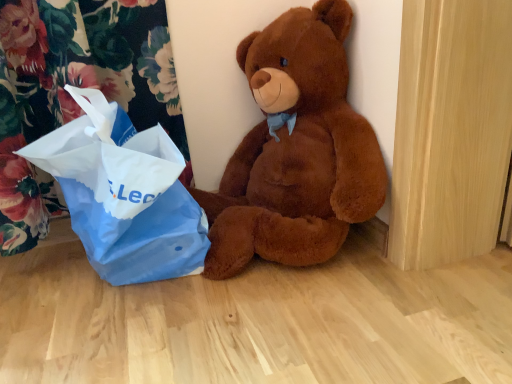
Describe the element at coordinates (76, 86) in the screenshot. I see `blue paper bag at left` at that location.

You are a GUI agent. You are given a task and a screenshot of the screen. Output one action in this format:
    pyautogui.click(x=<x>, y=<y>)
    Task: Click on the blue paper bag at left
    Image resolution: width=512 pixels, height=384 pixels.
    Given the screenshot: What is the action you would take?
    pyautogui.click(x=76, y=86)

You are a GUI agent. You are given a task and a screenshot of the screen. Output one action in this format:
    pyautogui.click(x=<x>, y=<y>)
    Task: Click on the brown plush teddy bear at center
    Image resolution: width=512 pixels, height=384 pixels.
    Given the screenshot: What is the action you would take?
    pyautogui.click(x=295, y=150)

This screenshot has width=512, height=384. What do you see at coordinates (295, 150) in the screenshot?
I see `brown plush teddy bear at center` at bounding box center [295, 150].

At what (x,y) coordinates should I click in order to perform the action: click on blue paper bag at left. Please return your answer as a coordinate pair (x, y). Looking at the image, I should click on (76, 86).

Considering the positions of objects brown plush teddy bear at center and blue paper bag at left in the image provided, who is more to the left, brown plush teddy bear at center or blue paper bag at left?

blue paper bag at left.

Which object is closer to the camera, brown plush teddy bear at center or blue paper bag at left?

brown plush teddy bear at center is closer to the camera.

Which is further, (284, 114) or (2, 154)?

Positioned behind is point (284, 114).

From the image's perspective, does brown plush teddy bear at center appear higher than blue paper bag at left?

Yes, from the image's perspective, brown plush teddy bear at center is over blue paper bag at left.

From a real-world perspective, is brown plush teddy bear at center positioned under blue paper bag at left based on gravity?

No, from a real-world perspective, brown plush teddy bear at center is not below blue paper bag at left.

Between brown plush teddy bear at center and blue paper bag at left, which one has smaller width?

blue paper bag at left is thinner.

Can you confirm if brown plush teddy bear at center is taller than blue paper bag at left?

Yes.

Is brown plush teddy bear at center bigger than blue paper bag at left?

Indeed, brown plush teddy bear at center has a larger size compared to blue paper bag at left.

Is blue paper bag at left located within brown plush teddy bear at center?

No, blue paper bag at left is not inside brown plush teddy bear at center.

Would you say brown plush teddy bear at center is a long distance from blue paper bag at left?

brown plush teddy bear at center is near blue paper bag at left, not far away.

Is brown plush teddy bear at center oriented towards blue paper bag at left?

No, brown plush teddy bear at center does not turn towards blue paper bag at left.

Can you tell me how much brown plush teddy bear at center and blue paper bag at left differ in facing direction?

brown plush teddy bear at center and blue paper bag at left are facing 4.16e-05 degrees away from each other.

This screenshot has height=384, width=512. Find the location of `teddy bear that is on the right side of blue paper bag at left`. teddy bear that is on the right side of blue paper bag at left is located at coordinates (295, 150).

Considering the positions of objects blue paper bag at left and brown plush teddy bear at center in the image provided, who is more to the right, blue paper bag at left or brown plush teddy bear at center?

Positioned to the right is brown plush teddy bear at center.

Does blue paper bag at left come in front of brown plush teddy bear at center?

That is False.

Considering the points (20, 147) and (310, 60), which point is in front, point (20, 147) or point (310, 60)?

Positioned in front is point (310, 60).

From the image's perspective, is blue paper bag at left under brown plush teddy bear at center?

Yes, from the image's perspective, blue paper bag at left is beneath brown plush teddy bear at center.

Consider the image. From a real-world perspective, between blue paper bag at left and brown plush teddy bear at center, who is vertically lower?

blue paper bag at left is physically lower.

Considering the sizes of objects blue paper bag at left and brown plush teddy bear at center in the image provided, who is wider, blue paper bag at left or brown plush teddy bear at center?

brown plush teddy bear at center.

Between blue paper bag at left and brown plush teddy bear at center, which one has more height?

Standing taller between the two is brown plush teddy bear at center.

Which of these two, blue paper bag at left or brown plush teddy bear at center, is bigger?

brown plush teddy bear at center is bigger.

Is brown plush teddy bear at center inside blue paper bag at left?

No.

Is blue paper bag at left directly adjacent to brown plush teddy bear at center?

No, blue paper bag at left is not with brown plush teddy bear at center.

Does blue paper bag at left turn towards brown plush teddy bear at center?

No, blue paper bag at left is not turned towards brown plush teddy bear at center.

Where is `teddy bear that is on the right side of blue paper bag at left`? teddy bear that is on the right side of blue paper bag at left is located at coordinates (295, 150).

Where is `teddy bear located in front of the blue paper bag at left`? This screenshot has width=512, height=384. teddy bear located in front of the blue paper bag at left is located at coordinates (295, 150).

At what (x,y) coordinates should I click in order to perform the action: click on curtain on the left of brown plush teddy bear at center. Please return your answer as a coordinate pair (x, y). The image size is (512, 384). Looking at the image, I should click on (76, 86).